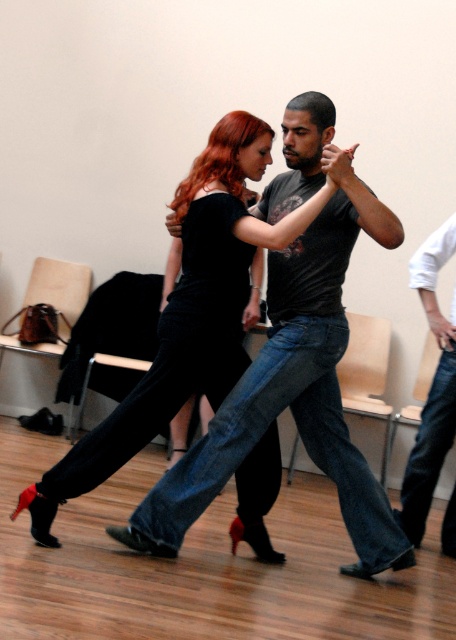
You are a photographer positioned at the entrance of the dance studio. You want to take a photo that includes both the point at coordinate point [181,291] and the point at coordinate point [440,442]. Based on their positions, which point should you focus on first to ensure both are in frame?

Point [181,291] is in front of point [440,442], so you should focus on point [181,291] first to ensure both are in frame.

You are a costume designer preparing for a dance performance. You have two outfits to consider for the lead dancer. The velvet black dress at center and the jeans at right. Which outfit would require more fabric to create?

The velvet black dress at center is bigger than jeans at right, so it would require more fabric to create.